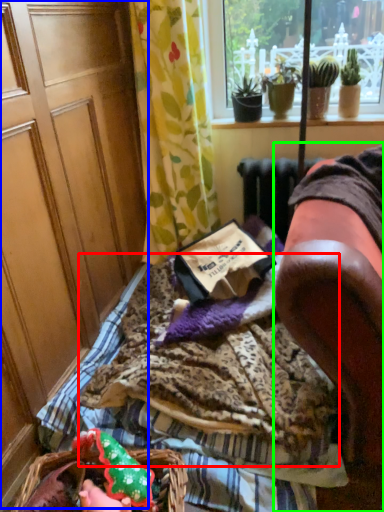
Question: Considering the real-world distances, which object is closest to blanket (highlighted by a red box)? screen door (highlighted by a blue box) or furniture (highlighted by a green box).

Choices:
 (A) screen door
 (B) furniture

Answer: (B)